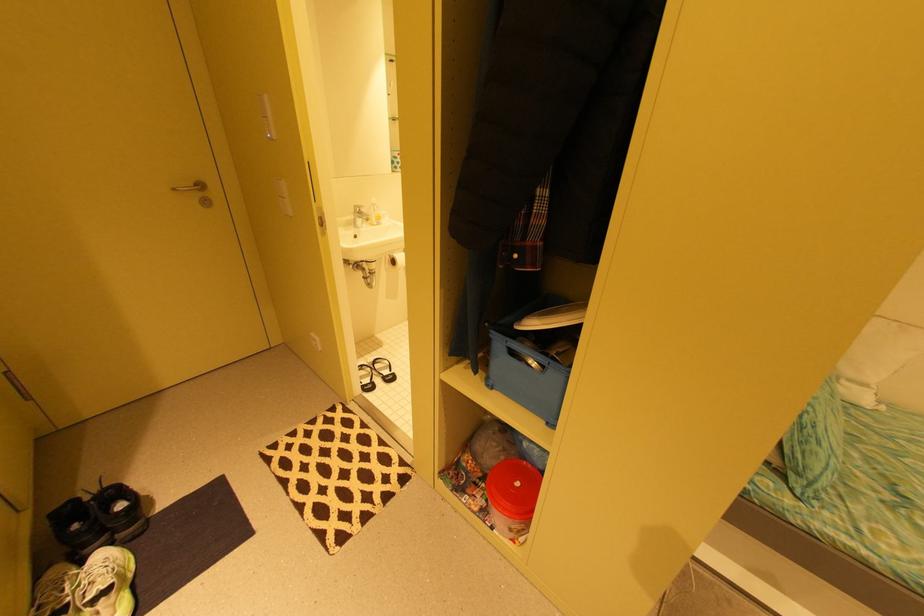
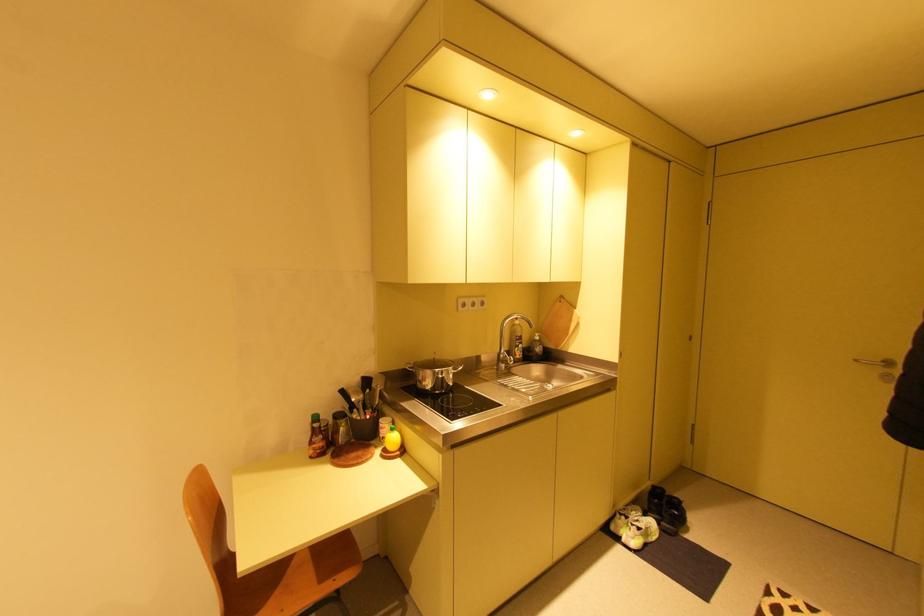
Where in the second image is the point corresponding to pixel 129 535 from the first image?

(670, 524)